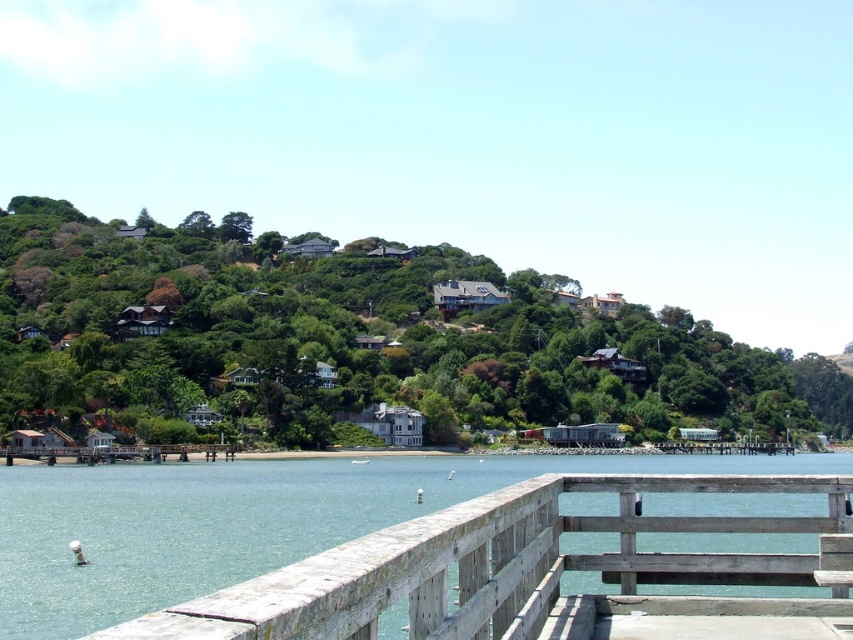
Question: Does green leafy hillside at upper center have a smaller size compared to weathered wood rail at lower center?

Choices:
 (A) no
 (B) yes

Answer: (A)

Question: Which point appears closest to the camera in this image?

Choices:
 (A) (387, 602)
 (B) (357, 262)

Answer: (A)

Question: Among these points, which one is nearest to the camera?

Choices:
 (A) (422, 561)
 (B) (160, 378)

Answer: (A)

Question: Does green leafy hillside at upper center appear under weathered wood rail at lower center?

Choices:
 (A) yes
 (B) no

Answer: (B)

Question: Which object appears farthest from the camera in this image?

Choices:
 (A) weathered wood rail at lower center
 (B) green leafy hillside at upper center

Answer: (B)

Question: Can you confirm if green leafy hillside at upper center is wider than weathered wood rail at lower center?

Choices:
 (A) yes
 (B) no

Answer: (A)